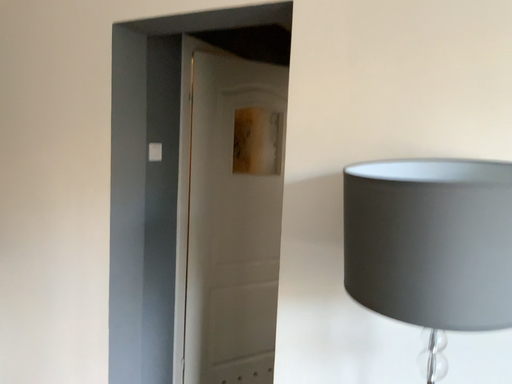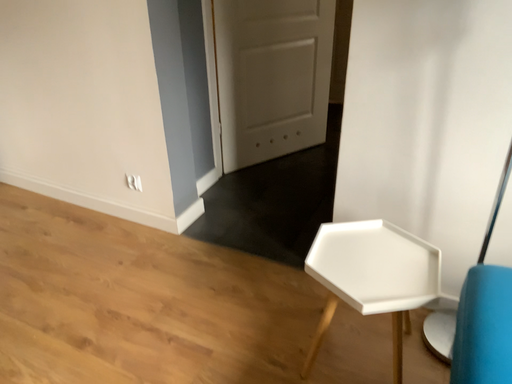
Question: Which way did the camera rotate in the video?

Choices:
 (A) rotated downward
 (B) rotated upward

Answer: (A)